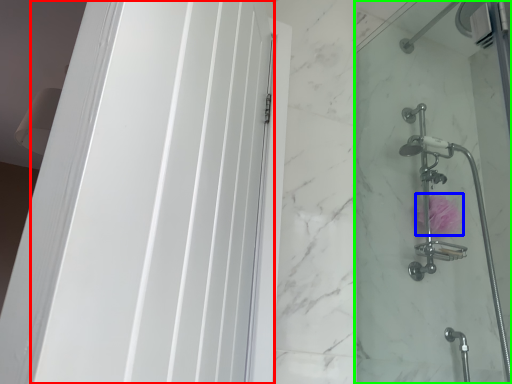
Question: Based on their relative distances, which object is farther from screen door (highlighted by a red box)? Choose from flower (highlighted by a blue box) and shower door (highlighted by a green box).

Choices:
 (A) flower
 (B) shower door

Answer: (A)